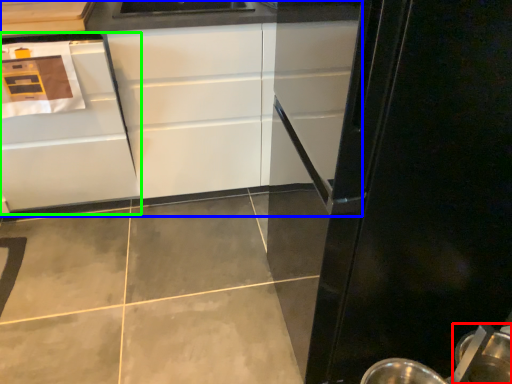
Question: Based on their relative distances, which object is farther from appliance (highlighted by a red box)? Choose from cabinetry (highlighted by a blue box) and cabinetry (highlighted by a green box).

Choices:
 (A) cabinetry
 (B) cabinetry

Answer: (B)